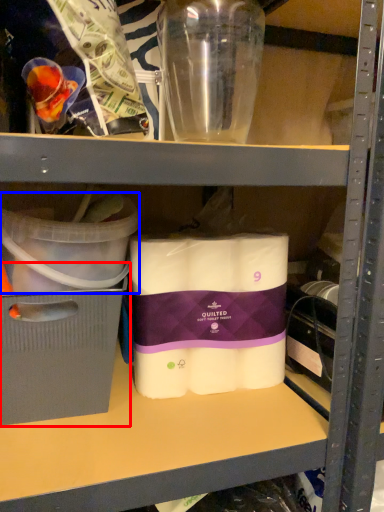
Question: Which object is closer to the camera taking this photo, storage box (highlighted by a red box) or storage box (highlighted by a blue box)?

Choices:
 (A) storage box
 (B) storage box

Answer: (B)